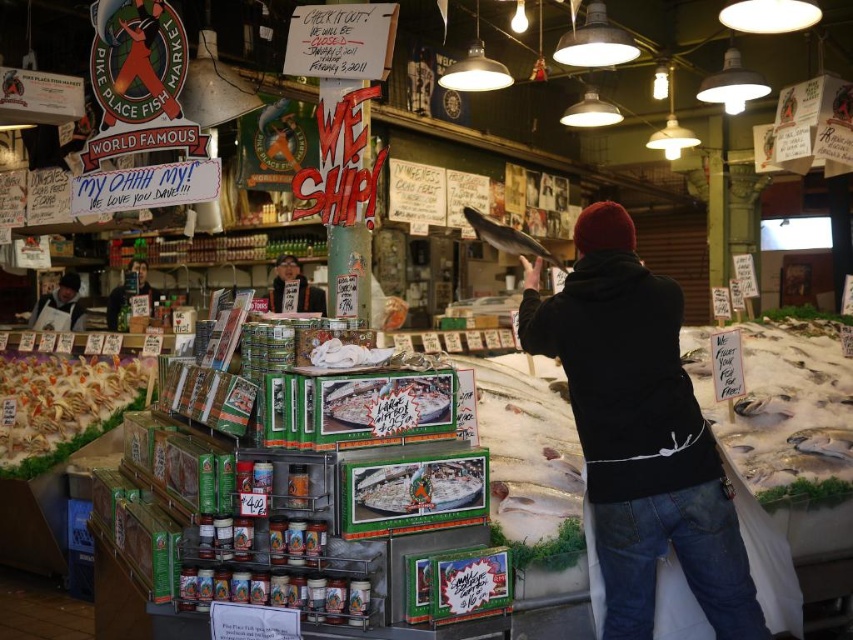
You are a customer at Pike Place Fish Market and you see the matte black phone at left and the white apron at left. Which object is positioned to the right side of the other?

The matte black phone at left is positioned to the right of the white apron at left.

You are standing at the entrance of Pike Place Fish Market and want to locate two specific points. The first point is at coordinates point (x=717, y=451) and the second is at point (x=122, y=282). Which point is closer to you?

Point (x=717, y=451) is in front of point (x=122, y=282), so the first point is closer to you.

You are a customer at Pike Place Fish Market and need to place your matte black phone at left on a surface next to the black matte jacket at center. Given their sizes, will the phone fit comfortably next to the jacket without overlapping?

The black matte jacket at center is narrower than the matte black phone at left. Since the jacket is narrower, placing the phone next to it may leave enough space, but the phone is wider, so they might overlap if placed side by side. Consider checking the available space or adjusting their positions for better fit.